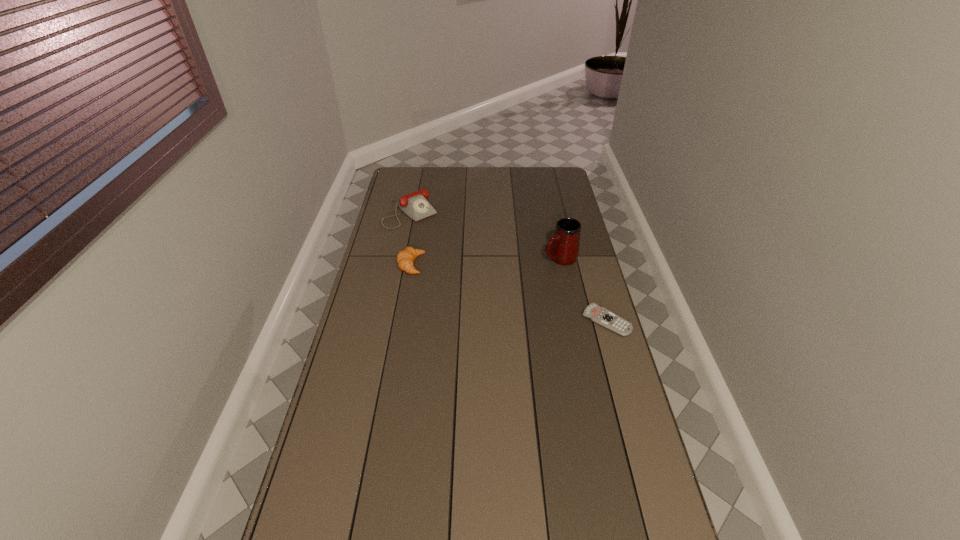
Locate an element on the screen. The width and height of the screenshot is (960, 540). vacant space at the left edge of the desktop is located at coordinates (377, 418).

Where is `vacant space at the right edge of the desktop`? Image resolution: width=960 pixels, height=540 pixels. vacant space at the right edge of the desktop is located at coordinates (562, 212).

Locate an element on the screen. This screenshot has height=540, width=960. vacant area at the near right corner of the desktop is located at coordinates (636, 516).

This screenshot has height=540, width=960. In order to click on vacant space in between the crescent roll and the tallest object in this screenshot , I will do `click(486, 261)`.

This screenshot has width=960, height=540. What are the coordinates of `free space between the crescent roll and the tallest object` in the screenshot? It's located at (486, 261).

Find the location of a particular element. free point between the nearest object and the mug is located at coordinates (584, 289).

Locate an element on the screen. Image resolution: width=960 pixels, height=540 pixels. free point between the second shortest object and the shortest object is located at coordinates (509, 293).

This screenshot has width=960, height=540. Find the location of `vacant point located between the tallest object and the nearest object`. vacant point located between the tallest object and the nearest object is located at coordinates (584, 289).

Locate an element on the screen. The image size is (960, 540). vacant region between the remote control and the farthest object is located at coordinates (509, 267).

You are a GUI agent. You are given a task and a screenshot of the screen. Output one action in this format:
    pyautogui.click(x=<x>, y=<y>)
    Task: Click on the empty space between the crescent roll and the mug
    The width and height of the screenshot is (960, 540).
    Given the screenshot: What is the action you would take?
    coord(486,261)